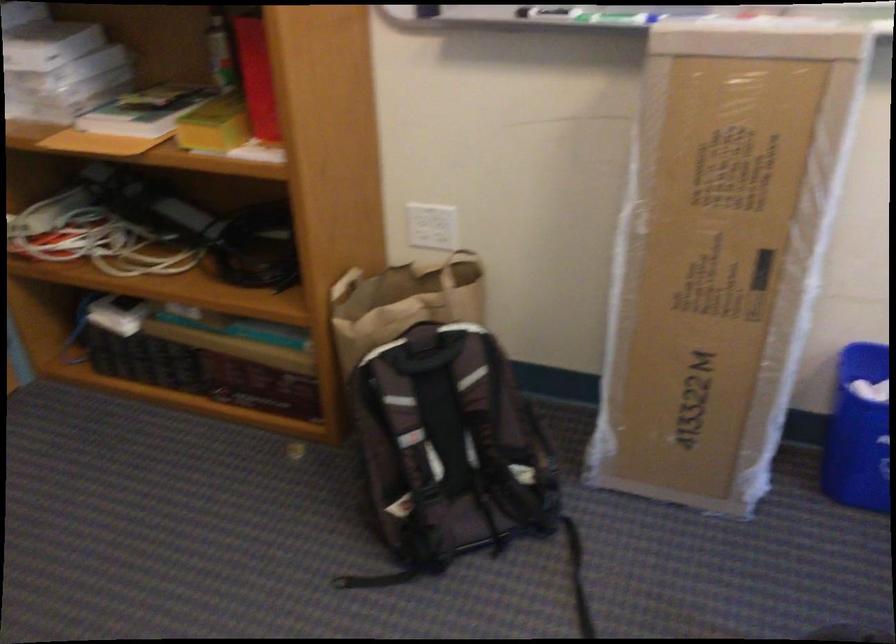
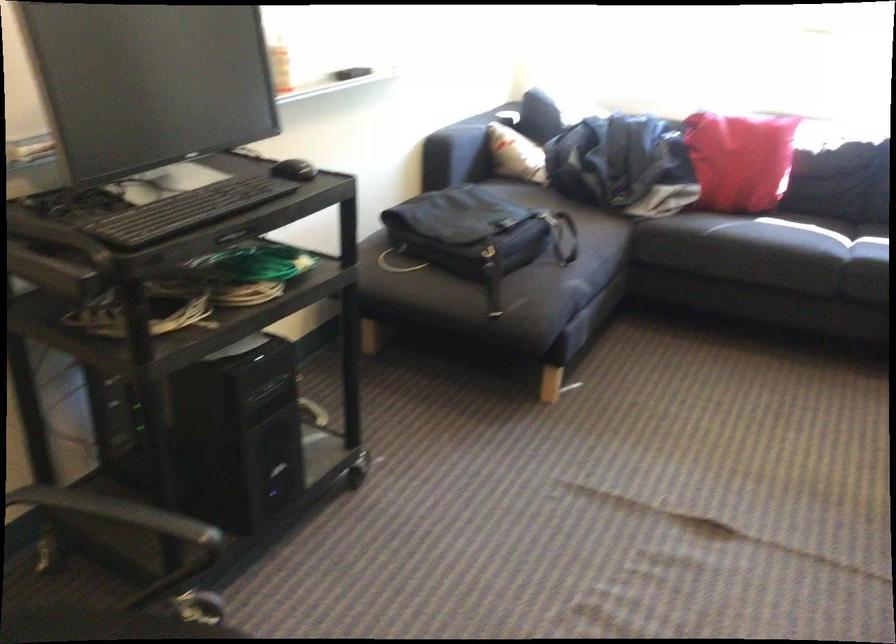
The images are taken continuously from a first-person perspective. In which direction is your viewpoint rotating?

The rotation direction of the camera is right-down.